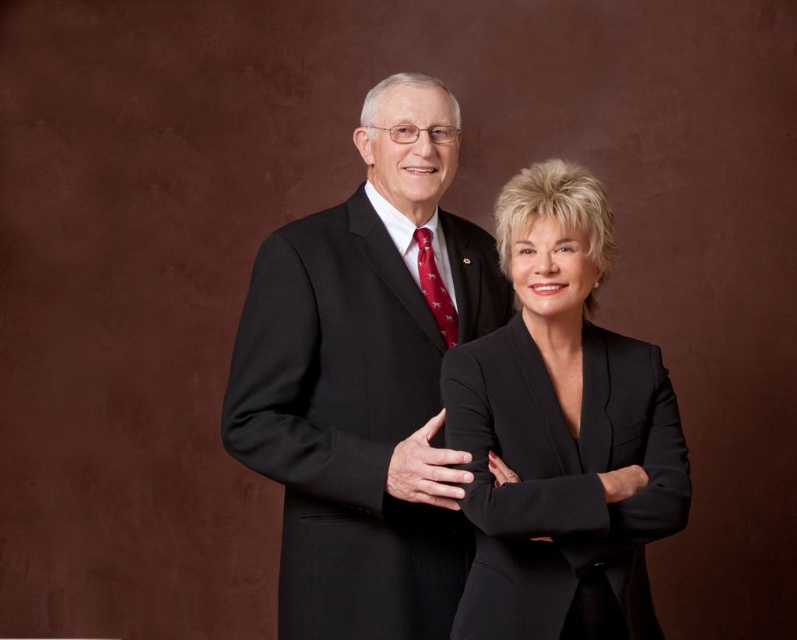
Question: Which point is farther to the camera?

Choices:
 (A) pos(591,241)
 (B) pos(422,285)

Answer: (B)

Question: Does matte black suit at center have a larger size compared to black matte suit at center?

Choices:
 (A) yes
 (B) no

Answer: (A)

Question: Which point appears closest to the camera in this image?

Choices:
 (A) (517, 176)
 (B) (356, 436)

Answer: (A)

Question: Where is matte black suit at center located in relation to black matte suit at center in the image?

Choices:
 (A) left
 (B) right

Answer: (A)

Question: Is matte black suit at center closer to camera compared to black matte suit at center?

Choices:
 (A) yes
 (B) no

Answer: (B)